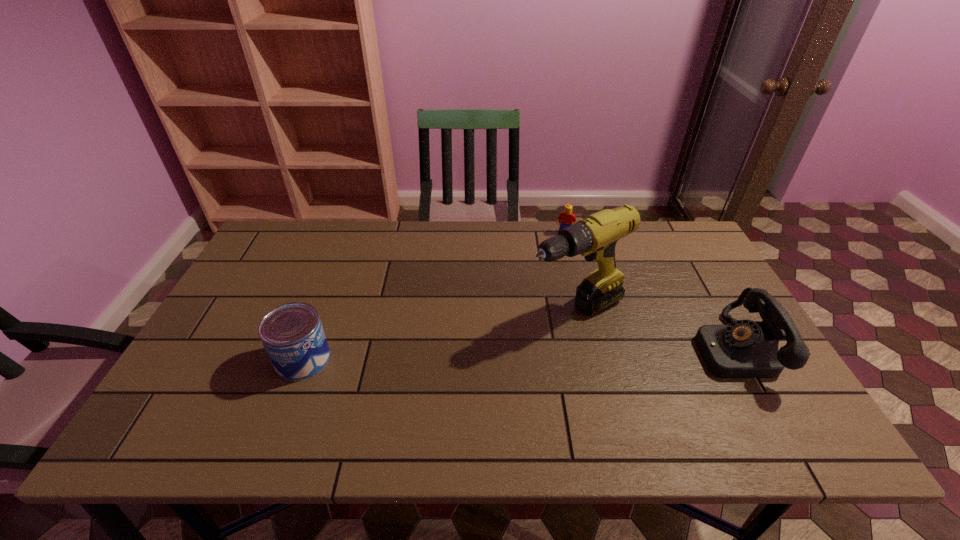
Find the location of a particular element. object that is at the near right corner is located at coordinates (744, 349).

Locate an element on the screen. The height and width of the screenshot is (540, 960). vacant space at the far edge is located at coordinates (498, 233).

I want to click on vacant region at the near edge of the desktop, so click(x=247, y=409).

Identify the location of free space at the left edge of the desktop. The height and width of the screenshot is (540, 960). (248, 282).

I want to click on free point at the right edge, so click(x=701, y=327).

I want to click on vacant space at the far right corner of the desktop, so click(667, 265).

The height and width of the screenshot is (540, 960). I want to click on free space that is in between the telephone and the Lego, so click(648, 291).

You are a GUI agent. You are given a task and a screenshot of the screen. Output one action in this format:
    pyautogui.click(x=<x>, y=<y>)
    Task: Click on the free spot between the telephone and the shortest object
    This screenshot has height=540, width=960.
    Given the screenshot: What is the action you would take?
    pyautogui.click(x=648, y=291)

Where is `free space between the third tallest object and the telephone`? The width and height of the screenshot is (960, 540). free space between the third tallest object and the telephone is located at coordinates (517, 354).

You are a GUI agent. You are given a task and a screenshot of the screen. Output one action in this format:
    pyautogui.click(x=<x>, y=<y>)
    Task: Click on the free space between the tallest object and the telephone
    
    Given the screenshot: What is the action you would take?
    pyautogui.click(x=654, y=330)